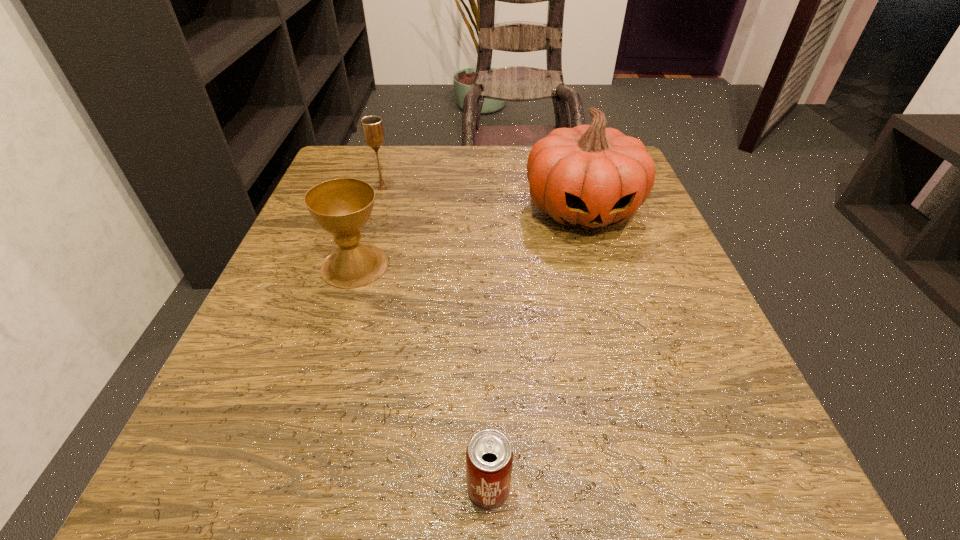
Where is `pumpkin positioned at the far edge`? pumpkin positioned at the far edge is located at coordinates (589, 176).

I want to click on chalice that is at the far edge, so click(372, 127).

Find the location of a particular element. The image size is (960, 540). object at the near edge is located at coordinates (489, 456).

I want to click on object present at the right edge, so click(589, 176).

The image size is (960, 540). Find the location of `object at the far left corner`. object at the far left corner is located at coordinates (372, 127).

Where is `object situated at the far right corner`? The image size is (960, 540). object situated at the far right corner is located at coordinates (589, 176).

In order to click on free space at the far edge of the desktop in this screenshot , I will do `click(405, 177)`.

The width and height of the screenshot is (960, 540). In the image, there is a desktop. Find the location of `vacant space at the near edge`. vacant space at the near edge is located at coordinates (607, 475).

Where is `vacant space at the left edge of the desktop`? Image resolution: width=960 pixels, height=540 pixels. vacant space at the left edge of the desktop is located at coordinates (235, 403).

You are a GUI agent. You are given a task and a screenshot of the screen. Output one action in this format:
    pyautogui.click(x=<x>, y=<y>)
    Task: Click on the blank space at the right edge of the desktop
    This screenshot has width=960, height=540.
    Given the screenshot: What is the action you would take?
    pyautogui.click(x=689, y=335)